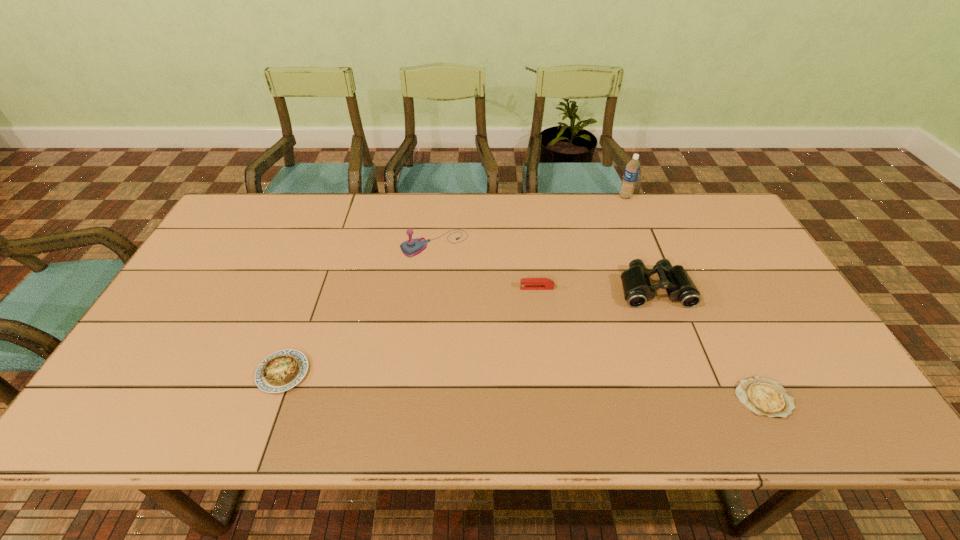
Where is `joystick that is positioned at the far edge`? This screenshot has width=960, height=540. joystick that is positioned at the far edge is located at coordinates (412, 247).

Find the location of a particular element. object situated at the near edge is located at coordinates (765, 397).

Locate an element on the screen. object that is at the right edge is located at coordinates (765, 397).

You are a GUI agent. You are given a task and a screenshot of the screen. Output one action in this format:
    pyautogui.click(x=<x>, y=<y>)
    Task: Click on the object that is at the near right corner
    The height and width of the screenshot is (540, 960).
    Given the screenshot: What is the action you would take?
    pyautogui.click(x=765, y=397)

This screenshot has width=960, height=540. I want to click on vacant position at the far edge of the desktop, so click(644, 214).

Where is `vacant space at the near edge of the desktop`? Image resolution: width=960 pixels, height=540 pixels. vacant space at the near edge of the desktop is located at coordinates (297, 407).

In the image, there is a desktop. Identify the location of vacant space at the left edge. (229, 268).

In the image, there is a desktop. Identify the location of vacant space at the right edge. The image size is (960, 540). (780, 307).

This screenshot has width=960, height=540. Identify the location of free point at the far left corner. (258, 236).

At what (x,y) coordinates should I click in order to perform the action: click on vacant space that's between the stapler and the farthest object. Please return your answer as a coordinate pair (x, y). Image resolution: width=960 pixels, height=540 pixels. Looking at the image, I should click on (581, 242).